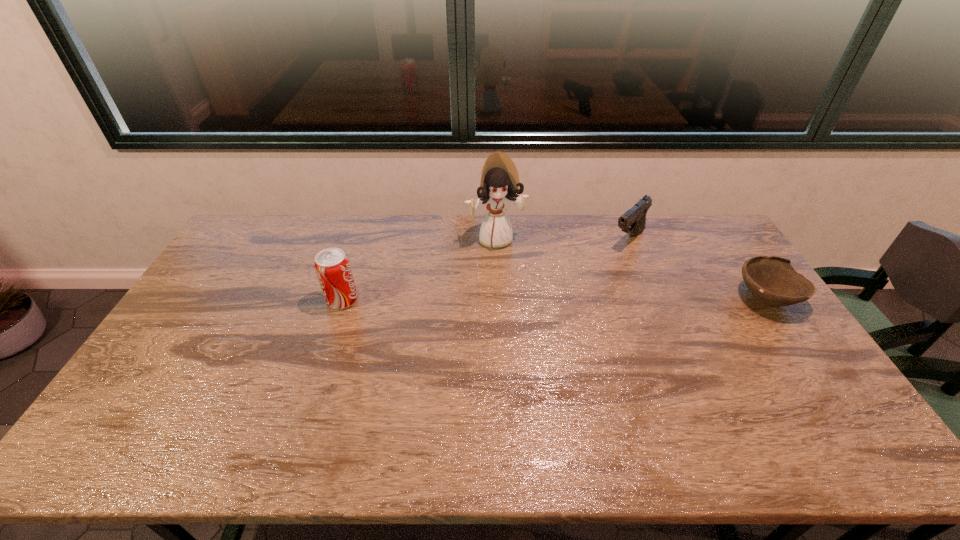
Find the location of a particular element. The height and width of the screenshot is (540, 960). the leftmost object is located at coordinates click(x=332, y=266).

Locate an element on the screen. the shortest object is located at coordinates (772, 280).

This screenshot has height=540, width=960. Identify the location of bowl. (772, 280).

At what (x,y) coordinates should I click in order to perform the action: click on the second shortest object. Please return your answer as a coordinate pair (x, y). The height and width of the screenshot is (540, 960). Looking at the image, I should click on (633, 221).

You are a GUI agent. You are given a task and a screenshot of the screen. Output one action in this format:
    pyautogui.click(x=<x>, y=<y>)
    Task: Click on the pistol
    This screenshot has height=540, width=960.
    Given the screenshot: What is the action you would take?
    pyautogui.click(x=633, y=221)

This screenshot has height=540, width=960. In order to click on the tallest object in this screenshot , I will do `click(499, 183)`.

Locate an element on the screen. The image size is (960, 540). the third object from right to left is located at coordinates (499, 183).

Identify the location of vacant area located 0.070m on the front of the leftmost object. (333, 329).

This screenshot has height=540, width=960. What are the coordinates of `free space located on the front of the bowl` in the screenshot? It's located at (795, 340).

Locate an element on the screen. Image resolution: width=960 pixels, height=540 pixels. vacant space situated 0.220m at the barrel of the second object from right to left is located at coordinates (586, 281).